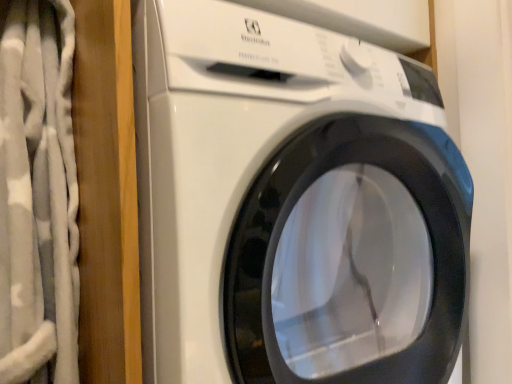
You are a GUI agent. You are given a task and a screenshot of the screen. Output one action in this format:
    pyautogui.click(x=<x>, y=<y>)
    Task: Click on the white glossy washing machine at center
    Image resolution: width=512 pixels, height=384 pixels.
    Given the screenshot: What is the action you would take?
    pyautogui.click(x=292, y=204)

Measure the distance between point (175, 124) and camera.

18.11 inches.

What do you see at coordinates (292, 204) in the screenshot? The image size is (512, 384). I see `white glossy washing machine at center` at bounding box center [292, 204].

From the picture: What is the approximate height of white glossy washing machine at center?

The height of white glossy washing machine at center is 30.93 inches.

You are a GUI agent. You are given a task and a screenshot of the screen. Output one action in this format:
    pyautogui.click(x=<x>, y=<y>)
    Task: Click on the white glossy washing machine at center
    
    Given the screenshot: What is the action you would take?
    [x=292, y=204]